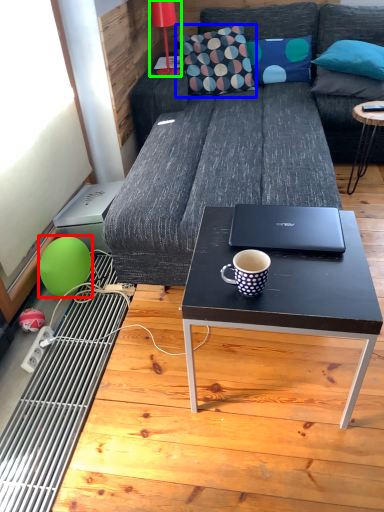
Question: Based on their relative distances, which object is nearer to teal (highlighted by a red box)? Choose from throw pillow (highlighted by a blue box) and lamp (highlighted by a green box).

Choices:
 (A) throw pillow
 (B) lamp

Answer: (A)